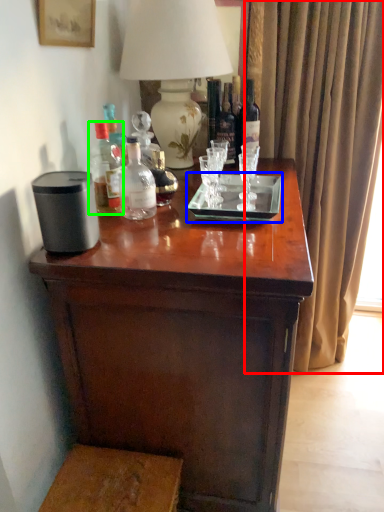
Question: Which object is the closest to the curtain (highlighted by a red box)? Choose among these: glass plate (highlighted by a blue box) or bottle (highlighted by a green box).

Choices:
 (A) glass plate
 (B) bottle

Answer: (A)